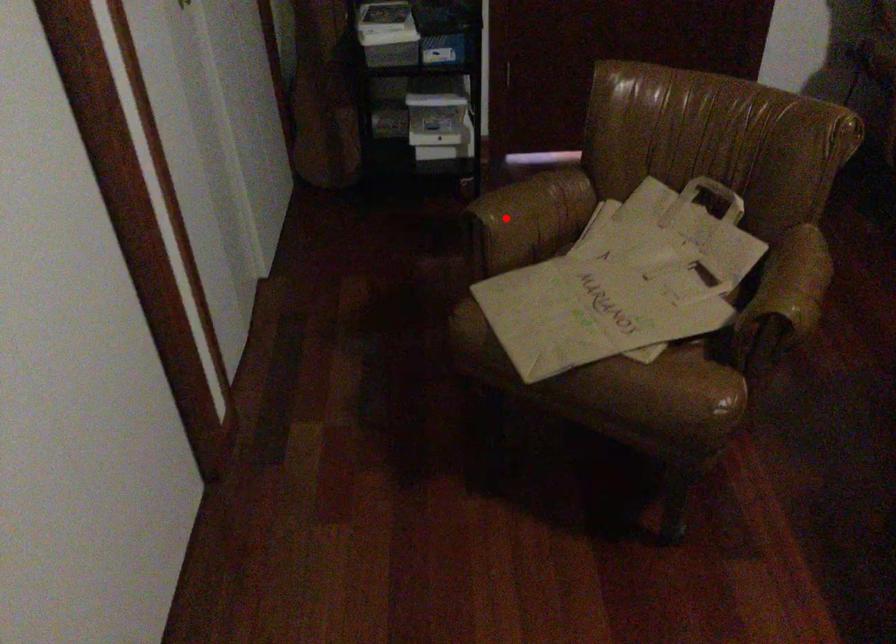
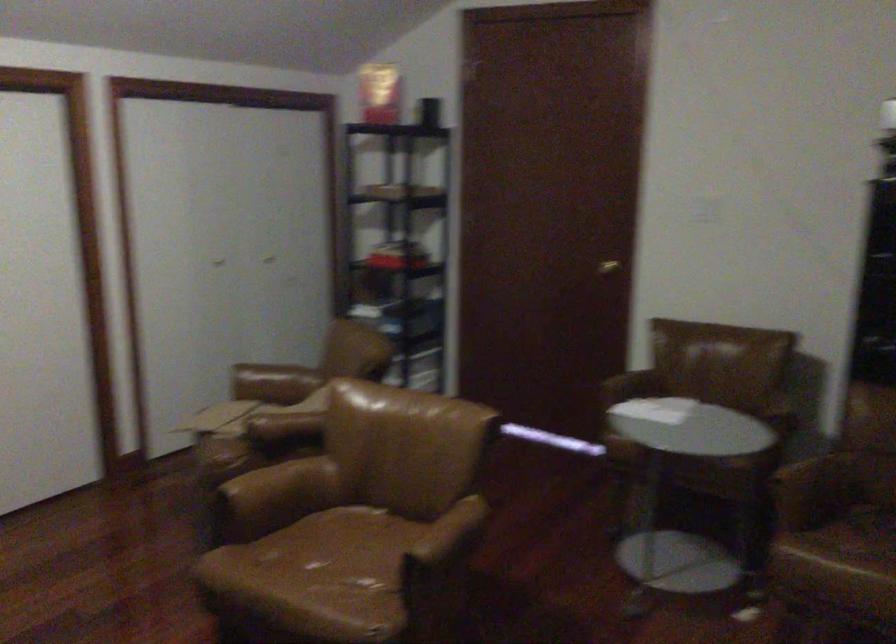
Question: I am providing you with two images of the same scene from different viewpoints. Given a red point in image1, look at the same physical point in image2. Is it:

Choices:
 (A) Closer to the viewpoint
 (B) Farther from the viewpoint

Answer: (B)